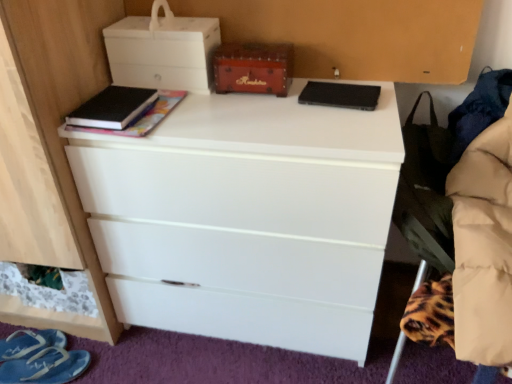
Question: Does black fabric swivel chair at right have a lesser height compared to black matte speaker at upper center, placed as the first book when sorted from right to left?

Choices:
 (A) no
 (B) yes

Answer: (A)

Question: Is black fabric swivel chair at right taller than black matte speaker at upper center, placed as the first book when sorted from right to left?

Choices:
 (A) no
 (B) yes

Answer: (B)

Question: Is black fabric swivel chair at right not close to black matte speaker at upper center, placed as the first book when sorted from right to left?

Choices:
 (A) no
 (B) yes

Answer: (A)

Question: From a real-world perspective, is black fabric swivel chair at right positioned under black matte speaker at upper center, the second book viewed from the left, based on gravity?

Choices:
 (A) yes
 (B) no

Answer: (A)

Question: From the image's perspective, is black fabric swivel chair at right over black matte speaker at upper center, placed as the first book when sorted from right to left?

Choices:
 (A) no
 (B) yes

Answer: (A)

Question: Is black fabric swivel chair at right wider than black matte speaker at upper center, placed as the first book when sorted from right to left?

Choices:
 (A) yes
 (B) no

Answer: (A)

Question: Does wooden chest at center, marked as the second storage box in a left-to-right arrangement, contain black matte speaker at upper center, the second book viewed from the left?

Choices:
 (A) yes
 (B) no

Answer: (B)

Question: From a real-world perspective, is wooden chest at center, placed as the 1th storage box when sorted from right to left, over black matte speaker at upper center, placed as the first book when sorted from right to left?

Choices:
 (A) no
 (B) yes

Answer: (B)

Question: Is the position of wooden chest at center, marked as the second storage box in a left-to-right arrangement, more distant than that of black matte speaker at upper center, placed as the first book when sorted from right to left?

Choices:
 (A) no
 (B) yes

Answer: (B)

Question: From a real-world perspective, is wooden chest at center, placed as the 1th storage box when sorted from right to left, positioned under black matte speaker at upper center, the second book viewed from the left, based on gravity?

Choices:
 (A) no
 (B) yes

Answer: (A)

Question: Is wooden chest at center, placed as the 1th storage box when sorted from right to left, oriented away from black matte speaker at upper center, placed as the first book when sorted from right to left?

Choices:
 (A) yes
 (B) no

Answer: (B)

Question: Is wooden chest at center, placed as the 1th storage box when sorted from right to left, smaller than black matte speaker at upper center, placed as the first book when sorted from right to left?

Choices:
 (A) yes
 (B) no

Answer: (B)

Question: Is white matte chest of drawers at center at the back of blue fabric sandal at lower left, which ranks as the 2th footwear in front-to-back order?

Choices:
 (A) yes
 (B) no

Answer: (B)